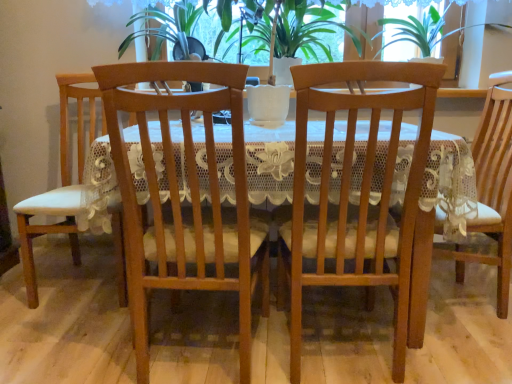
Question: Which direction should I rotate to face matte wood chair at center, positioned as the 1th chair in right-to-left order, — up or down?

Choices:
 (A) down
 (B) up

Answer: (B)

Question: Does transparent lace at upper center have a greater height compared to matte wood chair at center, positioned as the 1th chair in right-to-left order?

Choices:
 (A) yes
 (B) no

Answer: (B)

Question: Considering the relative sizes of transparent lace at upper center and matte wood chair at center, which is the 4th chair in left-to-right order, in the image provided, is transparent lace at upper center wider than matte wood chair at center, which is the 4th chair in left-to-right order,?

Choices:
 (A) yes
 (B) no

Answer: (B)

Question: Is transparent lace at upper center facing towards matte wood chair at center, positioned as the 1th chair in right-to-left order?

Choices:
 (A) yes
 (B) no

Answer: (B)

Question: Is transparent lace at upper center not within matte wood chair at center, positioned as the 1th chair in right-to-left order?

Choices:
 (A) no
 (B) yes

Answer: (B)

Question: Is matte wood chair at center, which is the 4th chair in left-to-right order, a part of transparent lace at upper center?

Choices:
 (A) no
 (B) yes

Answer: (A)

Question: Is transparent lace at upper center further to camera compared to matte wood chair at center, positioned as the 1th chair in right-to-left order?

Choices:
 (A) no
 (B) yes

Answer: (B)

Question: Is matte wood chair at center, which appears as the 3th chair when viewed from the right, positioned with its back to transparent lace at upper center?

Choices:
 (A) no
 (B) yes

Answer: (A)

Question: Is matte wood chair at center, which appears as the 3th chair when viewed from the right, shorter than transparent lace at upper center?

Choices:
 (A) no
 (B) yes

Answer: (A)

Question: Is matte wood chair at center, marked as the second chair in a left-to-right arrangement, oriented towards transparent lace at upper center?

Choices:
 (A) no
 (B) yes

Answer: (A)

Question: Can you confirm if matte wood chair at center, marked as the second chair in a left-to-right arrangement, is positioned to the right of transparent lace at upper center?

Choices:
 (A) yes
 (B) no

Answer: (B)

Question: Considering the relative sizes of matte wood chair at center, which appears as the 3th chair when viewed from the right, and transparent lace at upper center in the image provided, is matte wood chair at center, which appears as the 3th chair when viewed from the right, thinner than transparent lace at upper center?

Choices:
 (A) no
 (B) yes

Answer: (A)

Question: From a real-world perspective, is matte wood chair at center, which appears as the 3th chair when viewed from the right, positioned under transparent lace at upper center based on gravity?

Choices:
 (A) no
 (B) yes

Answer: (B)

Question: Can you confirm if wooden table at center is shorter than green leafy plant at center?

Choices:
 (A) yes
 (B) no

Answer: (B)